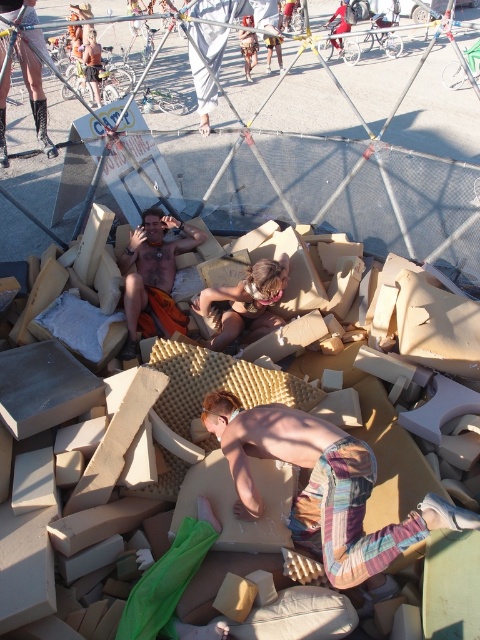
Where is the shiny orange shorts at center located in the image?

The shiny orange shorts at center is located at point (154, 276) in the image.